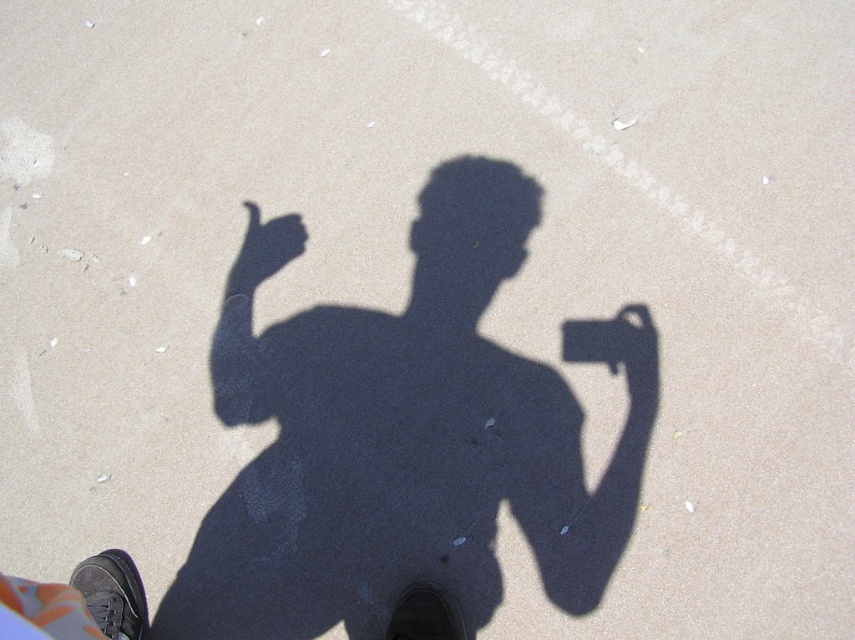
Question: Is matte black hand at center wider than metallic silver phone at center?

Choices:
 (A) yes
 (B) no

Answer: (A)

Question: Which of the following is the closest to the observer?

Choices:
 (A) (649, 323)
 (B) (249, 202)

Answer: (A)

Question: Among these objects, which one is farthest from the camera?

Choices:
 (A) metallic silver phone at center
 (B) matte black hand at center

Answer: (B)

Question: Among these objects, which one is nearest to the camera?

Choices:
 (A) metallic silver phone at center
 (B) matte black hand at center

Answer: (A)

Question: Is matte black hand at center below metallic silver phone at center?

Choices:
 (A) no
 (B) yes

Answer: (A)

Question: Is matte black hand at center positioned in front of metallic silver phone at center?

Choices:
 (A) yes
 (B) no

Answer: (B)